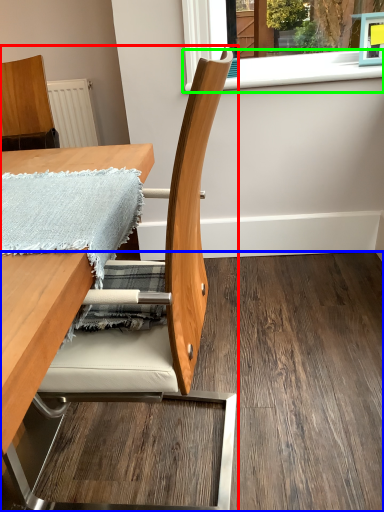
Question: Considering the real-world distances, which object is closest to chair (highlighted by a red box)? plywood (highlighted by a blue box) or window sill (highlighted by a green box).

Choices:
 (A) plywood
 (B) window sill

Answer: (A)